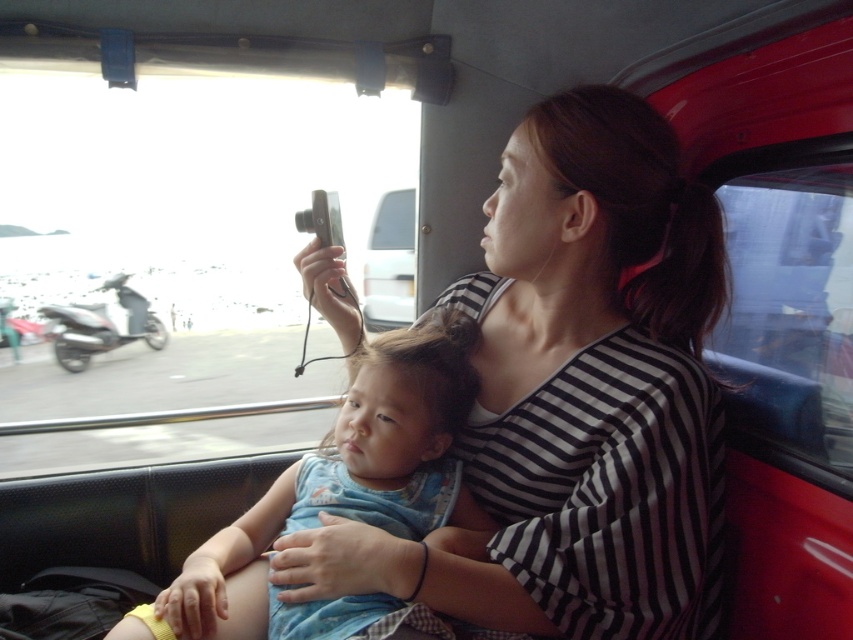
Can you confirm if striped fabric shirt at center is positioned to the right of blue denim dress at center?

Indeed, striped fabric shirt at center is positioned on the right side of blue denim dress at center.

From the picture: Can you confirm if striped fabric shirt at center is smaller than blue denim dress at center?

Incorrect, striped fabric shirt at center is not smaller in size than blue denim dress at center.

The image size is (853, 640). Find the location of `striped fabric shirt at center`. striped fabric shirt at center is located at coordinates (576, 396).